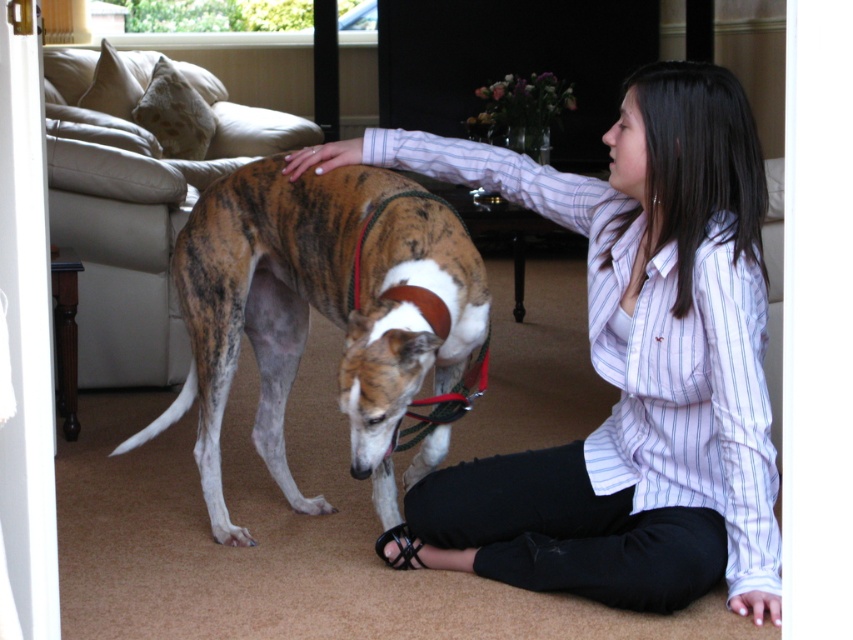
Does matte striped shirt at center come behind brindle fur dog at center?

That is False.

Describe the element at coordinates (628, 364) in the screenshot. The image size is (853, 640). I see `matte striped shirt at center` at that location.

Does point (659, 136) come closer to viewer compared to point (432, 308)?

Yes, it is.

At what (x,y) coordinates should I click in order to perform the action: click on matte striped shirt at center. Please return your answer as a coordinate pair (x, y). Looking at the image, I should click on (628, 364).